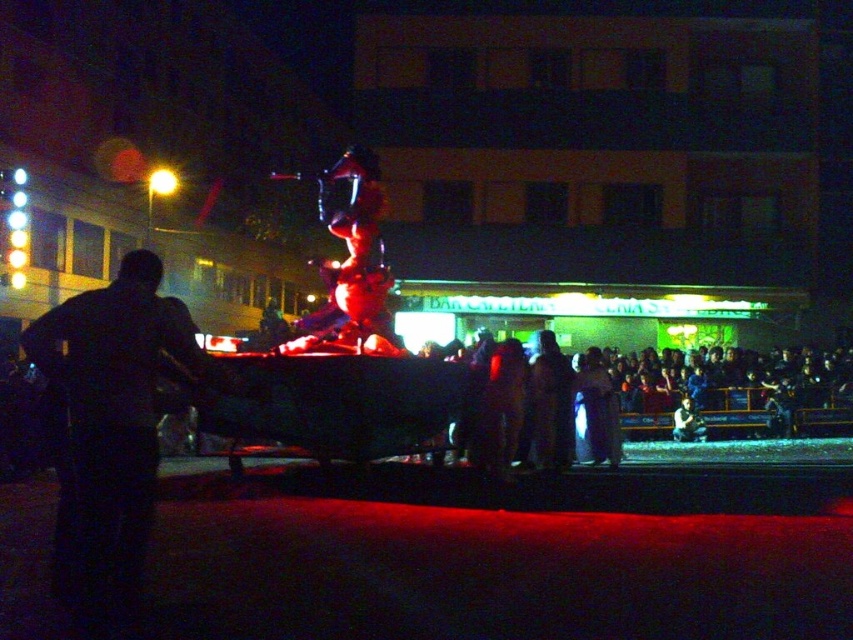
You are a photographer standing in front of the float. You want to take a photo that includes both the dark clothing crowd at right and the dark fabric dress at center. Which object should you focus on first to ensure both are in sharp focus?

You should focus on the dark clothing crowd at right first because it is closer to you than the dark fabric dress at center. By focusing on the closer object, the farther one may still be in acceptable focus depending on the depth of field.

You are standing at the center of the scene and want to move towards the dark clothing crowd at right. Which direction should you move in?

You should move towards the right direction to reach the dark clothing crowd at right since it is located at point 0.620 on the x axis.